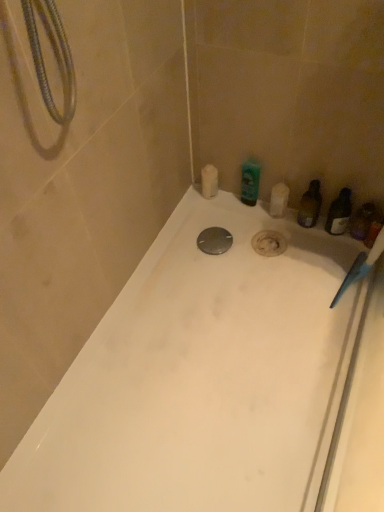
Locate an element on the screen. free space in front of metallic silver drain at center is located at coordinates (219, 284).